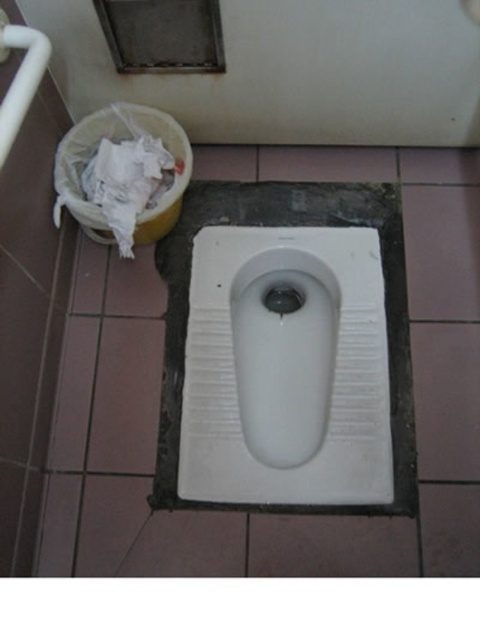
Can you confirm if white ceramic urinal at center is smaller than white crumpled paper at upper left?

No.

The width and height of the screenshot is (480, 640). Identify the location of white ceramic urinal at center. (286, 369).

At what (x,y) coordinates should I click in order to perform the action: click on white ceramic urinal at center. Please return your answer as a coordinate pair (x, y). This screenshot has width=480, height=640. Looking at the image, I should click on (286, 369).